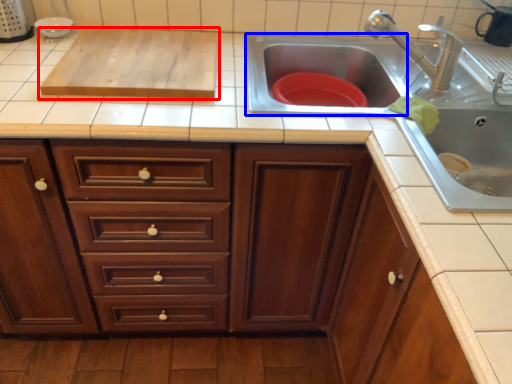
Question: Which object appears farthest to the camera in this image, wide (highlighted by a red box) or sink (highlighted by a blue box)?

Choices:
 (A) wide
 (B) sink

Answer: (B)